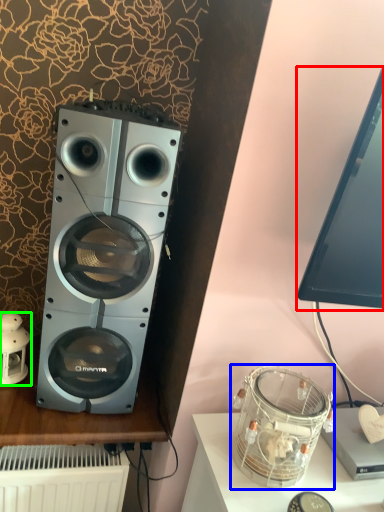
Question: Based on their relative distances, which object is nearer to computer monitor (highlighted by a red box)? Choose from appliance (highlighted by a blue box) and toy (highlighted by a green box).

Choices:
 (A) appliance
 (B) toy

Answer: (A)